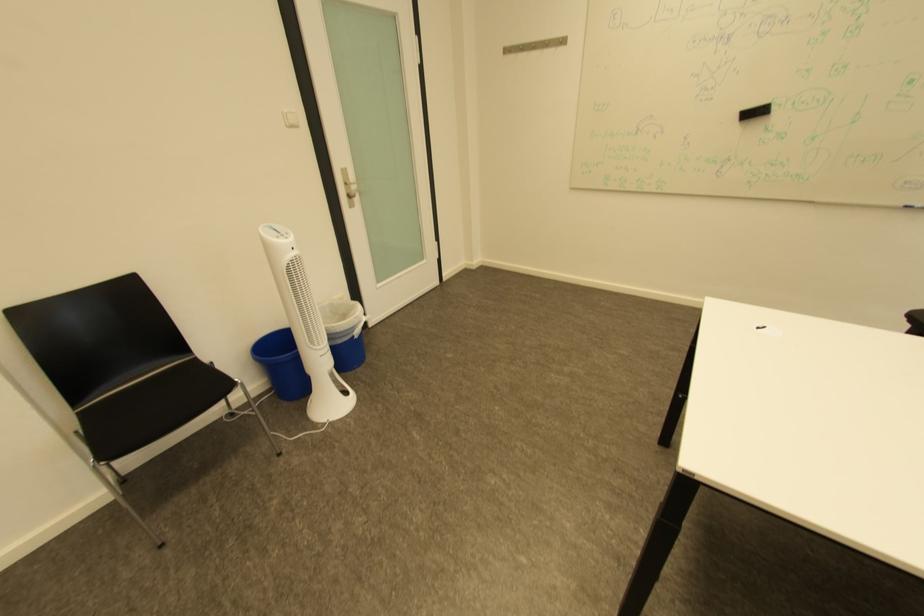
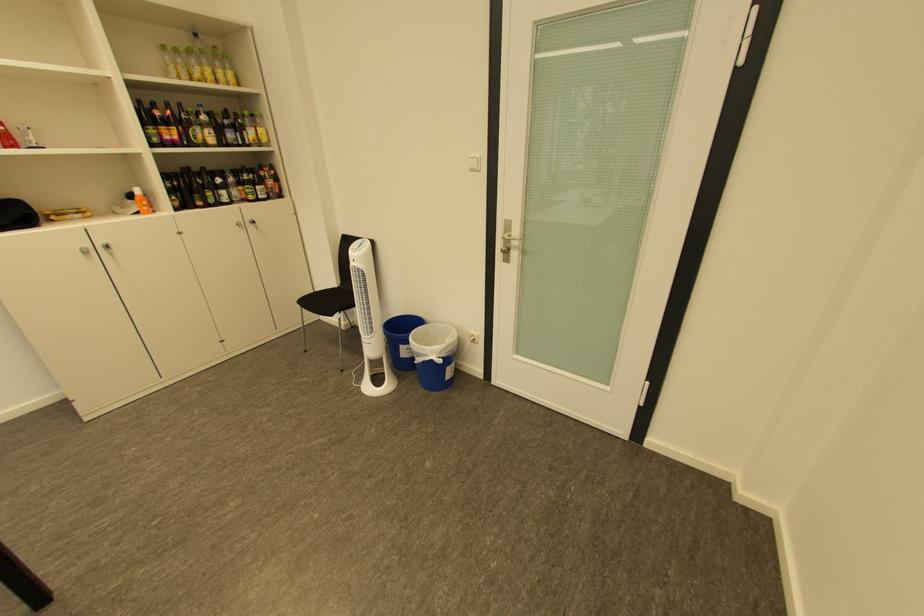
The point at (295, 240) is marked in the first image. Where is the corresponding point in the second image?

(363, 253)